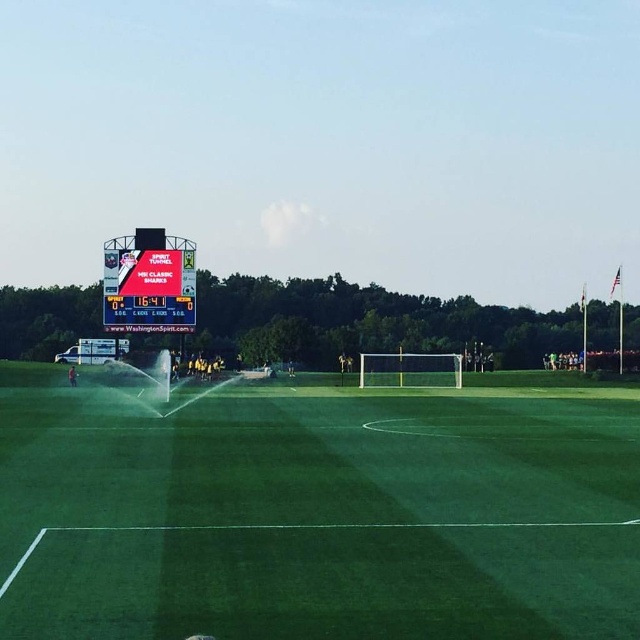
Question: Which object is farther from the camera taking this photo?

Choices:
 (A) white plastic scoreboard at upper left
 (B) green artificial turf at center

Answer: (A)

Question: Observing the image, what is the correct spatial positioning of green artificial turf at center in reference to white plastic scoreboard at upper left?

Choices:
 (A) below
 (B) above

Answer: (A)

Question: Does green artificial turf at center appear over white plastic scoreboard at upper left?

Choices:
 (A) no
 (B) yes

Answer: (A)

Question: Considering the relative positions of green artificial turf at center and white plastic scoreboard at upper left in the image provided, where is green artificial turf at center located with respect to white plastic scoreboard at upper left?

Choices:
 (A) left
 (B) right

Answer: (B)